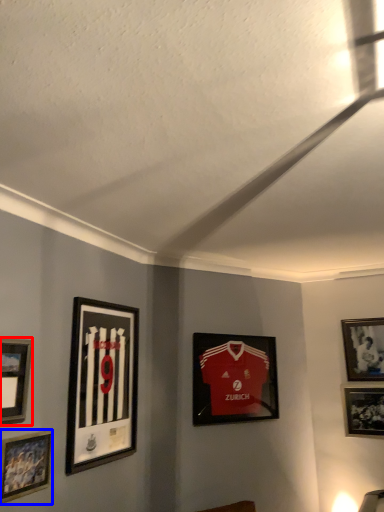
Question: Among these objects, which one is nearest to the camera, picture frame (highlighted by a red box) or picture frame (highlighted by a blue box)?

Choices:
 (A) picture frame
 (B) picture frame

Answer: (A)